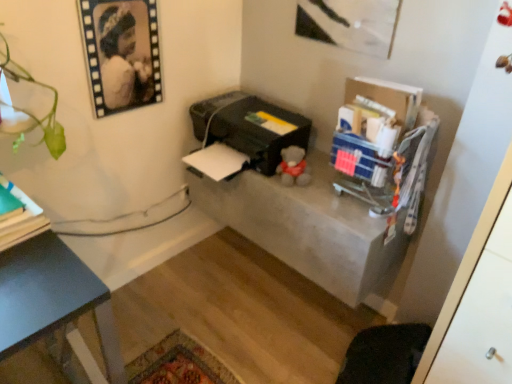
Where is `vacant space underneath green matte book at left (from a real-world perspective)`? vacant space underneath green matte book at left (from a real-world perspective) is located at coordinates (50, 373).